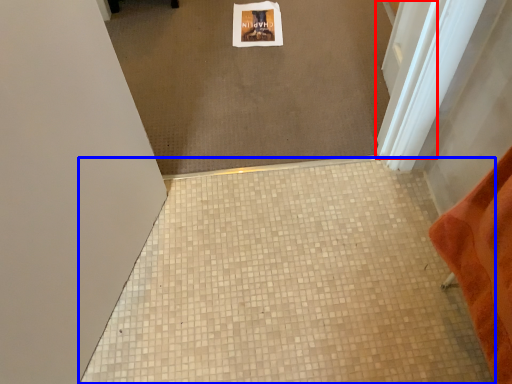
Question: Among these objects, which one is nearest to the camera, screen door (highlighted by a red box) or tile (highlighted by a blue box)?

Choices:
 (A) screen door
 (B) tile

Answer: (B)